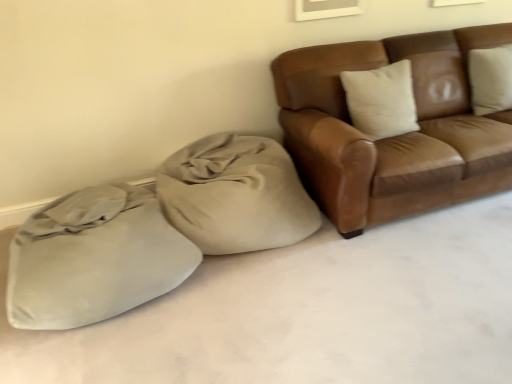
Question: Considering the relative sizes of brown leather couch at upper right and suede-like beige sack at lower left in the image provided, is brown leather couch at upper right thinner than suede-like beige sack at lower left?

Choices:
 (A) no
 (B) yes

Answer: (B)

Question: Does brown leather couch at upper right appear on the left side of suede-like beige sack at lower left?

Choices:
 (A) no
 (B) yes

Answer: (A)

Question: Is brown leather couch at upper right aimed at suede-like beige sack at lower left?

Choices:
 (A) no
 (B) yes

Answer: (A)

Question: Is the position of brown leather couch at upper right less distant than that of suede-like beige sack at lower left?

Choices:
 (A) no
 (B) yes

Answer: (A)

Question: Does brown leather couch at upper right have a larger size compared to suede-like beige sack at lower left?

Choices:
 (A) yes
 (B) no

Answer: (A)

Question: Is brown leather couch at upper right looking in the opposite direction of suede-like beige sack at lower left?

Choices:
 (A) no
 (B) yes

Answer: (A)

Question: From the image's perspective, is beige fabric bean bag at center above suede-like beige sack at lower left?

Choices:
 (A) no
 (B) yes

Answer: (B)

Question: Can you confirm if beige fabric bean bag at center is bigger than suede-like beige sack at lower left?

Choices:
 (A) yes
 (B) no

Answer: (B)

Question: From a real-world perspective, does beige fabric bean bag at center sit lower than suede-like beige sack at lower left?

Choices:
 (A) yes
 (B) no

Answer: (B)

Question: Does beige fabric bean bag at center come in front of suede-like beige sack at lower left?

Choices:
 (A) yes
 (B) no

Answer: (B)

Question: Is beige fabric bean bag at center wider than suede-like beige sack at lower left?

Choices:
 (A) no
 (B) yes

Answer: (A)

Question: Is beige fabric bean bag at center not within suede-like beige sack at lower left?

Choices:
 (A) yes
 (B) no

Answer: (A)

Question: Can you confirm if suede-like beige sack at lower left is shorter than beige fabric bean bag at center?

Choices:
 (A) yes
 (B) no

Answer: (A)